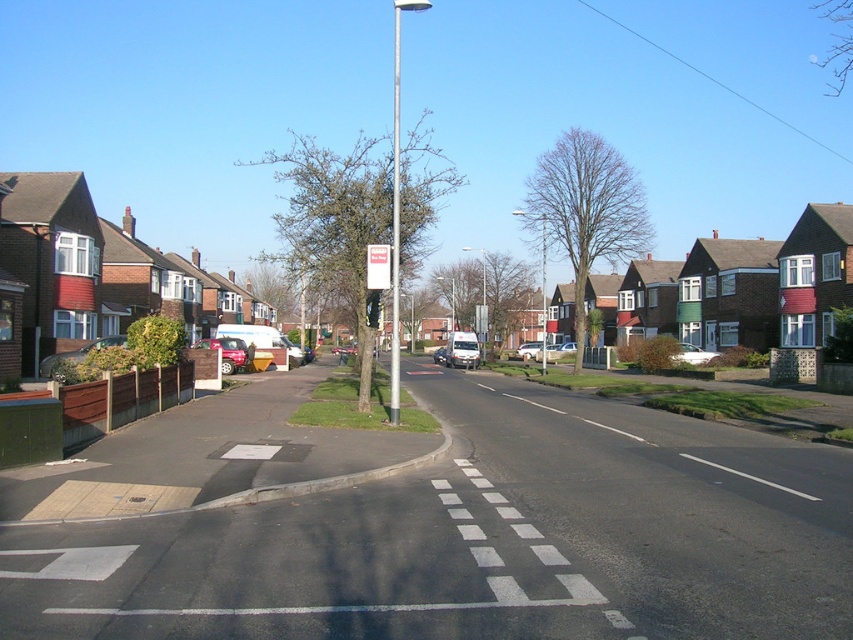
Question: Is metallic red car at left behind metallic traffic light at center?

Choices:
 (A) no
 (B) yes

Answer: (B)

Question: Which of these objects is positioned closest to the metallic silver van at center?

Choices:
 (A) white glossy car at center-right
 (B) white plastic sign at center
 (C) silver metallic car at center
 (D) metallic traffic light at center

Answer: (C)

Question: Considering the relative positions of metallic silver car at left and silver metallic car at center in the image provided, where is metallic silver car at left located with respect to silver metallic car at center?

Choices:
 (A) left
 (B) right

Answer: (A)

Question: Which is farther from the metallic red car at left?

Choices:
 (A) metallic silver van at center
 (B) white glossy car at center-right

Answer: (B)

Question: Estimate the real-world distances between objects in this image. Which object is closer to the white plastic sign at center?

Choices:
 (A) silver metallic sedan at center
 (B) metallic red car at left
 (C) silver metallic pole at center
 (D) metallic silver car at left

Answer: (D)

Question: Does white plastic sign at center appear under white glossy car at center-right?

Choices:
 (A) yes
 (B) no

Answer: (B)